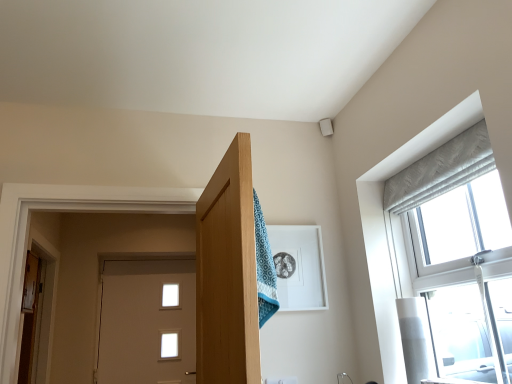
Locate an element on the screen. The image size is (512, 384). wooden door at left, the second door positioned from the right is located at coordinates (29, 316).

Image resolution: width=512 pixels, height=384 pixels. Describe the element at coordinates (29, 316) in the screenshot. I see `wooden door at left, acting as the second door starting from the back` at that location.

Describe the element at coordinates (147, 322) in the screenshot. The height and width of the screenshot is (384, 512). I see `white glossy door at center, which is the 2th door from left to right` at that location.

In order to face white glossy door at center, which is the 2th door from left to right, should I rotate leftwards or rightwards?

Rotate your view left by about 14.975°.

Measure the distance between point (159, 264) and camera.

A distance of 13.11 feet exists between point (159, 264) and camera.

This screenshot has height=384, width=512. I want to click on white glossy door at center, which is the 2th door from left to right, so click(x=147, y=322).

Locate an element on the screen. The height and width of the screenshot is (384, 512). wooden door at left, acting as the second door starting from the back is located at coordinates (29, 316).

Which object is positioned more to the right, white glossy door at center, which is the 1th door in right-to-left order, or wooden door at left, the first door positioned from the left?

white glossy door at center, which is the 1th door in right-to-left order.

In the image, is white glossy door at center, arranged as the 1th door when viewed from the back, positioned in front of or behind wooden door at left, the first door positioned from the front?

Visually, white glossy door at center, arranged as the 1th door when viewed from the back, is located behind wooden door at left, the first door positioned from the front.

Is point (127, 288) closer to viewer compared to point (33, 291)?

No, it is not.

From the image's perspective, between white glossy door at center, which is the 2th door from left to right, and wooden door at left, the second door positioned from the right, which one is located above?

wooden door at left, the second door positioned from the right.

From a real-world perspective, which is physically above, white glossy door at center, which is the 2th door from left to right, or wooden door at left, the second door positioned from the right?

wooden door at left, the second door positioned from the right.

Which object is wider, white glossy door at center, acting as the second door starting from the front, or wooden door at left, the first door positioned from the left?

white glossy door at center, acting as the second door starting from the front.

Considering the relative sizes of white glossy door at center, which is the 1th door in right-to-left order, and wooden door at left, the first door positioned from the front, in the image provided, is white glossy door at center, which is the 1th door in right-to-left order, shorter than wooden door at left, the first door positioned from the front,?

In fact, white glossy door at center, which is the 1th door in right-to-left order, may be taller than wooden door at left, the first door positioned from the front.

Can you confirm if white glossy door at center, acting as the second door starting from the front, is bigger than wooden door at left, the first door positioned from the left?

Correct, white glossy door at center, acting as the second door starting from the front, is larger in size than wooden door at left, the first door positioned from the left.

Would you say white glossy door at center, arranged as the 1th door when viewed from the back, is inside or outside wooden door at left, the second door positioned from the right?

white glossy door at center, arranged as the 1th door when viewed from the back, is located beyond the bounds of wooden door at left, the second door positioned from the right.

Are white glossy door at center, arranged as the 1th door when viewed from the back, and wooden door at left, the first door positioned from the front, located far from each other?

They are positioned close to each other.

Could you tell me if white glossy door at center, which is the 2th door from left to right, is turned towards wooden door at left, the first door positioned from the front?

No, white glossy door at center, which is the 2th door from left to right, does not turn towards wooden door at left, the first door positioned from the front.

How different are the orientations of white glossy door at center, which is the 1th door in right-to-left order, and wooden door at left, the second door positioned from the right, in degrees?

The angle between the facing direction of white glossy door at center, which is the 1th door in right-to-left order, and the facing direction of wooden door at left, the second door positioned from the right, is 7.46 degrees.

Locate an element on the screen. This screenshot has height=384, width=512. door on the right of wooden door at left, the second door positioned from the right is located at coordinates (147, 322).

Is wooden door at left, the first door positioned from the left, to the left or to the right of white glossy door at center, which is the 2th door from left to right, in the image?

wooden door at left, the first door positioned from the left, is to the left of white glossy door at center, which is the 2th door from left to right.

Between wooden door at left, acting as the second door starting from the back, and white glossy door at center, acting as the second door starting from the front, which one is positioned behind?

white glossy door at center, acting as the second door starting from the front, is further from the camera.

Considering the points (20, 374) and (115, 311), which point is in front, point (20, 374) or point (115, 311)?

The point (20, 374) is closer.

From the image's perspective, does wooden door at left, the first door positioned from the front, appear higher than white glossy door at center, arranged as the 1th door when viewed from the back?

Correct, wooden door at left, the first door positioned from the front, appears higher than white glossy door at center, arranged as the 1th door when viewed from the back, in the image.

Consider the image. From a real-world perspective, between wooden door at left, acting as the second door starting from the back, and white glossy door at center, acting as the second door starting from the front, who is vertically higher?

wooden door at left, acting as the second door starting from the back, from a real-world perspective.

Does wooden door at left, the first door positioned from the front, have a greater width compared to white glossy door at center, which is the 1th door in right-to-left order?

Incorrect, the width of wooden door at left, the first door positioned from the front, does not surpass that of white glossy door at center, which is the 1th door in right-to-left order.

Considering the sizes of objects wooden door at left, the second door positioned from the right, and white glossy door at center, arranged as the 1th door when viewed from the back, in the image provided, who is taller, wooden door at left, the second door positioned from the right, or white glossy door at center, arranged as the 1th door when viewed from the back,?

With more height is white glossy door at center, arranged as the 1th door when viewed from the back.

Can you confirm if wooden door at left, the first door positioned from the front, is bigger than white glossy door at center, acting as the second door starting from the front?

No, wooden door at left, the first door positioned from the front, is not bigger than white glossy door at center, acting as the second door starting from the front.

Can white glossy door at center, acting as the second door starting from the front, be found inside wooden door at left, acting as the second door starting from the back?

No, wooden door at left, acting as the second door starting from the back, does not contain white glossy door at center, acting as the second door starting from the front.

Is wooden door at left, the first door positioned from the left, directly adjacent to white glossy door at center, acting as the second door starting from the front?

No, wooden door at left, the first door positioned from the left, is not with white glossy door at center, acting as the second door starting from the front.

Is wooden door at left, the first door positioned from the left, turned away from white glossy door at center, acting as the second door starting from the front?

wooden door at left, the first door positioned from the left, is not turned away from white glossy door at center, acting as the second door starting from the front.

What's the angular difference between wooden door at left, acting as the second door starting from the back, and white glossy door at center, which is the 2th door from left to right,'s facing directions?

The facing directions of wooden door at left, acting as the second door starting from the back, and white glossy door at center, which is the 2th door from left to right, are 7.46 degrees apart.

In the scene shown: How much distance is there between wooden door at left, the first door positioned from the left, and white glossy door at center, acting as the second door starting from the front?

34.01 inches.

This screenshot has height=384, width=512. What are the coordinates of `door on the left of the white glossy door at center, which is the 2th door from left to right` in the screenshot? It's located at (29, 316).

At what (x,y) coordinates should I click in order to perform the action: click on door that appears on the left of white glossy door at center, acting as the second door starting from the front. Please return your answer as a coordinate pair (x, y). The height and width of the screenshot is (384, 512). Looking at the image, I should click on (29, 316).

Where is `door that appears above the white glossy door at center, arranged as the 1th door when viewed from the back (from a real-world perspective)`? door that appears above the white glossy door at center, arranged as the 1th door when viewed from the back (from a real-world perspective) is located at coordinates (x=29, y=316).